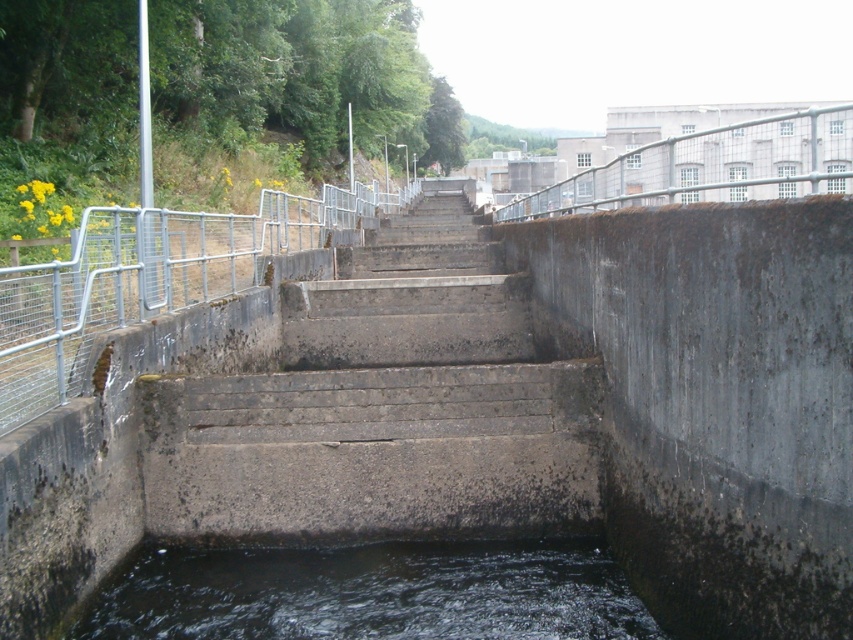
From the picture: You are a maintenance worker tasked with assessing the condition of the dark gray water at bottom center and the metallic gray rail at upper right. Which object is larger in size?

The metallic gray rail at upper right is larger than the dark gray water at bottom center.